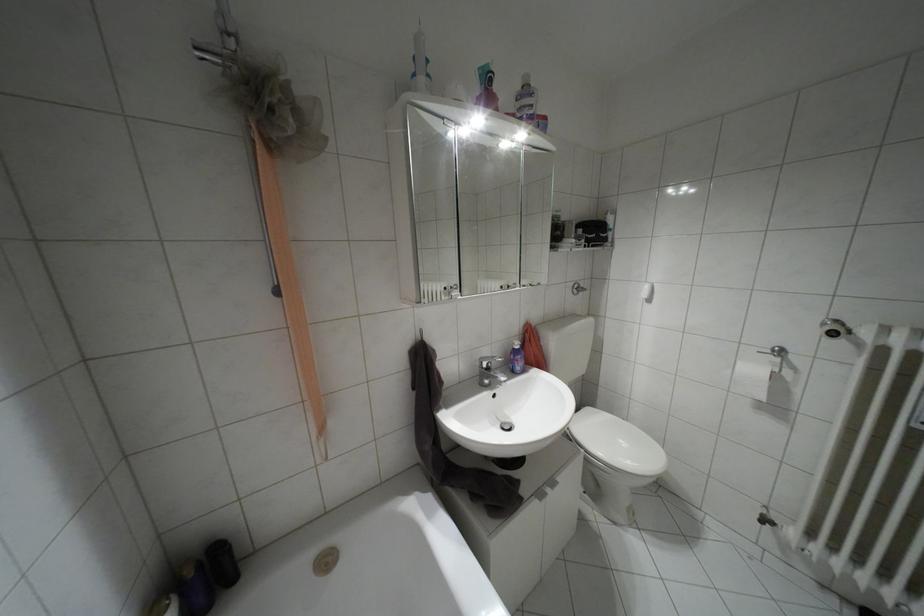
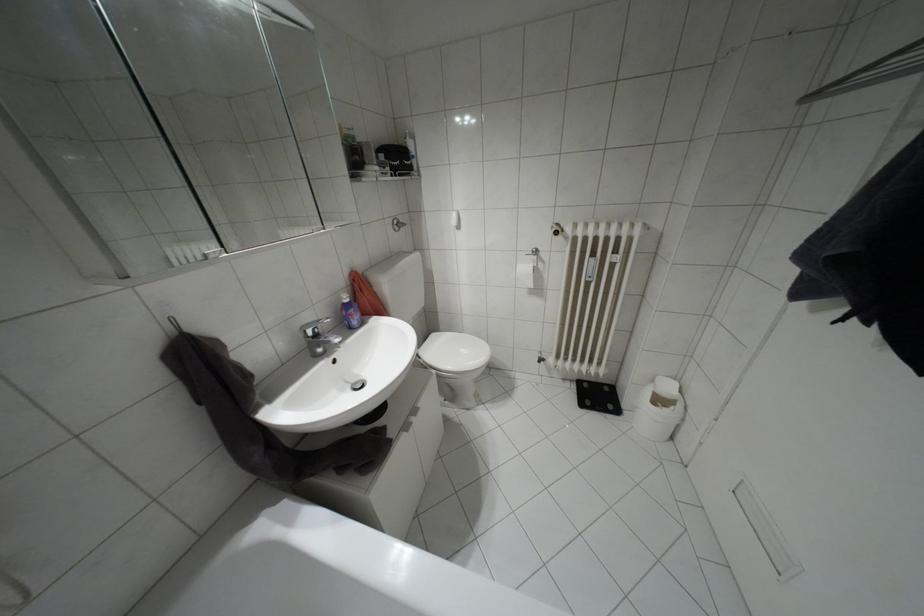
Find the pixel in the second image that matches (760,395) in the first image.

(530, 284)